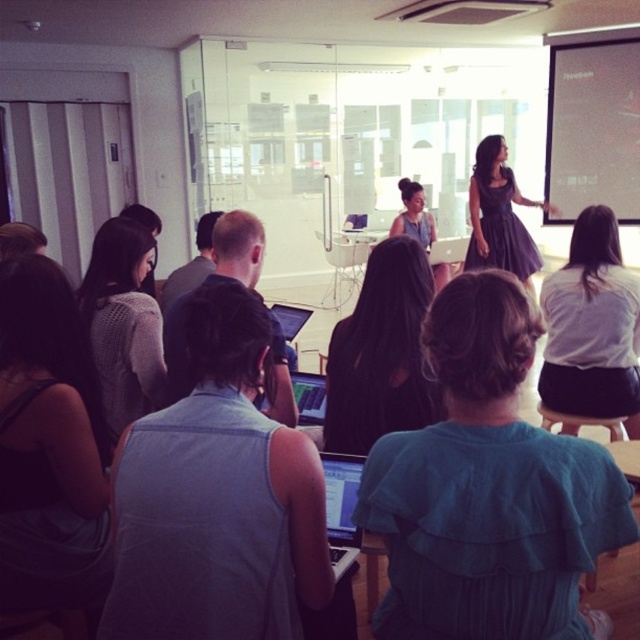
You are a photographer in the conference room. You want to take a photo of the gray fabric shirt at center and dark purple dress at upper right so that both are visible in the frame. Based on their positions, which one should you focus on first to ensure both are in the shot?

The gray fabric shirt at center is positioned on the left side of dark purple dress at upper right, so focusing on the dark purple dress at upper right first would help ensure both are captured in the frame since it is positioned further to the right.

You are sitting at the back of the conference room and want to hand a document to the person wearing the gray fabric shirt at center and the person in dark purple dress at upper right. Which person should you approach first based on their proximity to you?

You should approach the gray fabric shirt at center first because they are closer to you than the dark purple dress at upper right.